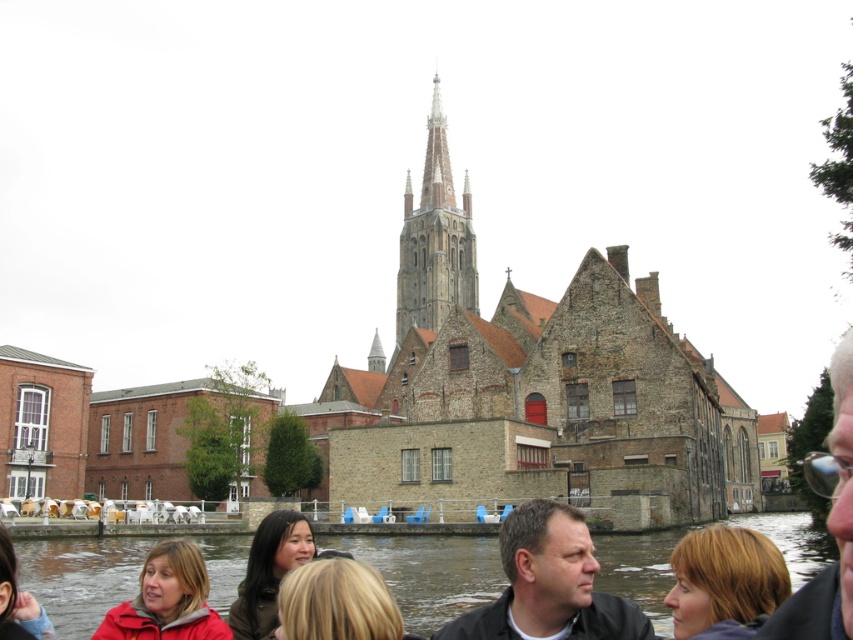
Based on the scene description and the coordinates provided, what does the point at coordinates (434, 240) represent in the image?

The point at coordinates (434, 240) marks the location of the brown stone tower at center in the image.

You are a photographer standing on the boat with the group of people. You want to take a photo that includes both the blonde hair at lower right and the blonde hair at lower left. Given that your camera has a maximum zoom range of 10 meters, will you be able to capture both subjects in a single frame without moving the camera?

The distance between the blonde hair at lower right and the blonde hair at lower left is 15.61 meters. Since your camera can only zoom up to 10 meters, you won t be able to capture both subjects in a single frame without moving the camera.

You are a photographer trying to capture the entire brick church at center and the blonde hair at lower left in one shot. Considering their sizes, which object will you need to frame more carefully to ensure it doesn

The blonde hair at lower left is smaller than the brick church at center, so you will need to ensure it is in the frame to avoid being too small or out of the shot.